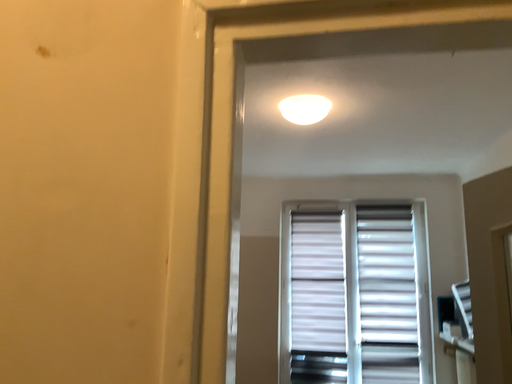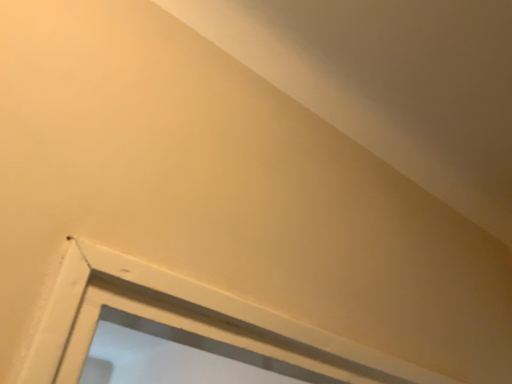
Question: Which way did the camera rotate in the video?

Choices:
 (A) rotated left
 (B) rotated right

Answer: (B)